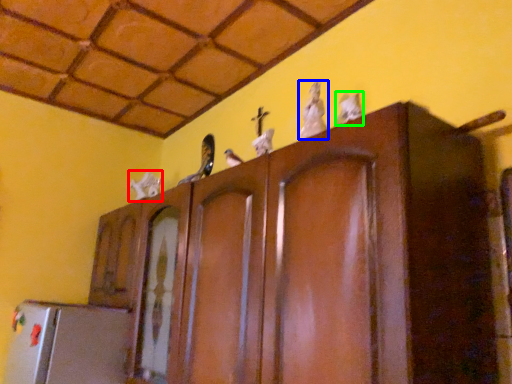
Question: Which object is the closest to the animal (highlighted by a red box)? Choose among these: animal (highlighted by a blue box) or animal (highlighted by a green box).

Choices:
 (A) animal
 (B) animal

Answer: (A)